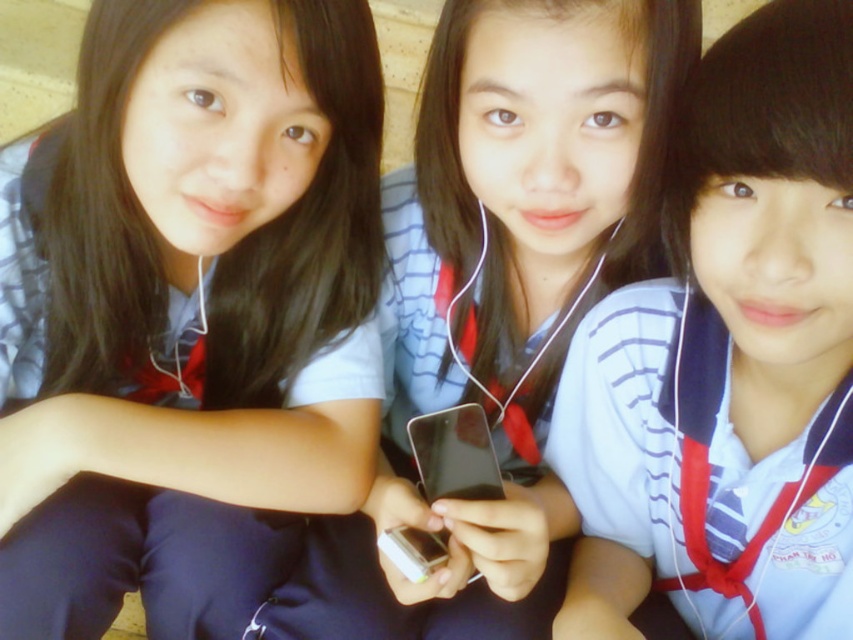
Question: Can you confirm if matte black phone at center is positioned above black glossy smartphone at center?

Choices:
 (A) no
 (B) yes

Answer: (B)

Question: Does blue striped shirt at center appear on the right side of black glossy smartphone at center?

Choices:
 (A) no
 (B) yes

Answer: (B)

Question: Estimate the real-world distances between objects in this image. Which object is farther from the blue striped shirt at center?

Choices:
 (A) black glossy smartphone at center
 (B) matte black phone at center
 (C) matte blue uniform at center

Answer: (C)

Question: Is blue striped shirt at center wider than black glossy smartphone at center?

Choices:
 (A) no
 (B) yes

Answer: (B)

Question: Which object is the farthest from the matte blue uniform at center?

Choices:
 (A) blue striped shirt at center
 (B) black glossy smartphone at center

Answer: (A)

Question: Among these objects, which one is farthest from the camera?

Choices:
 (A) matte blue uniform at center
 (B) matte black phone at center

Answer: (B)